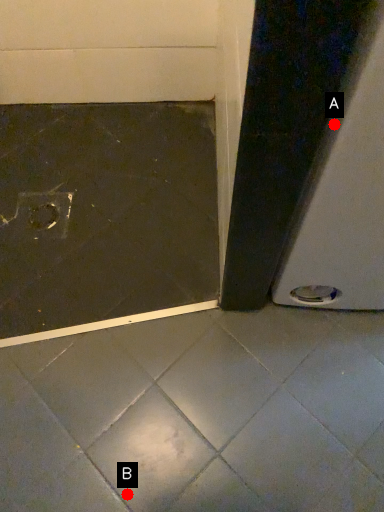
Question: Two points are circled on the image, labeled by A and B beside each circle. Which point is closer to the camera taking this photo?

Choices:
 (A) A is closer
 (B) B is closer

Answer: (A)